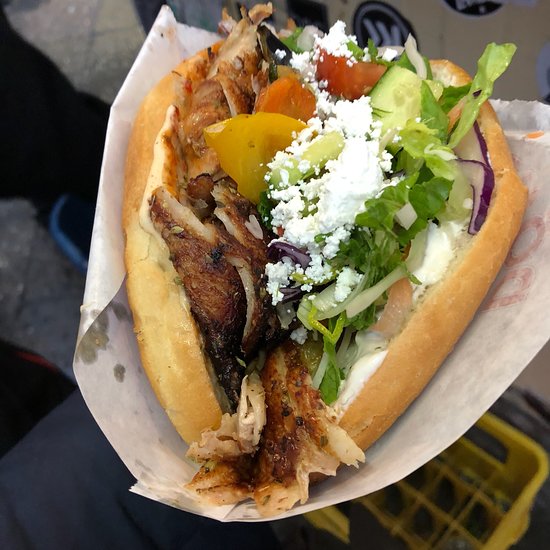
The image size is (550, 550). I want to click on wall, so click(x=453, y=33).